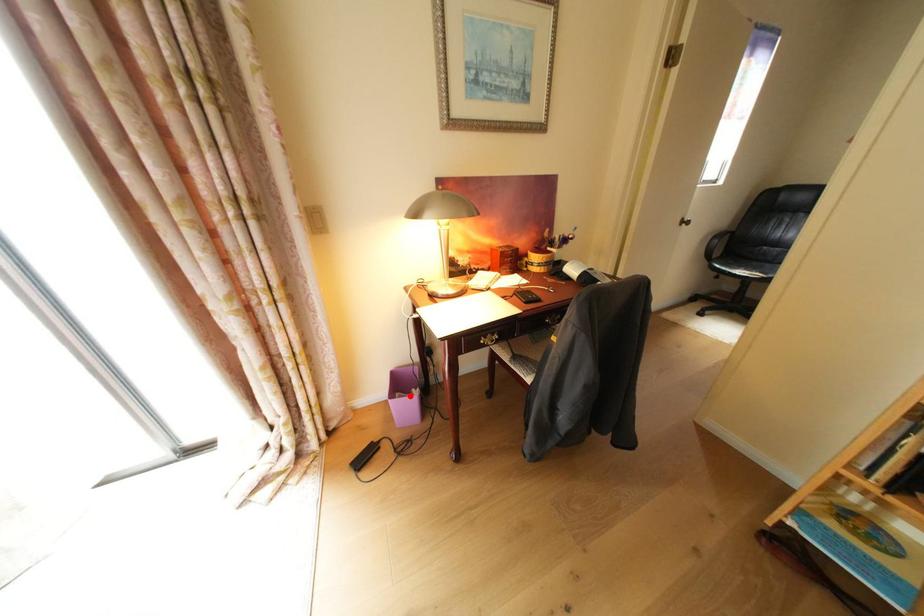
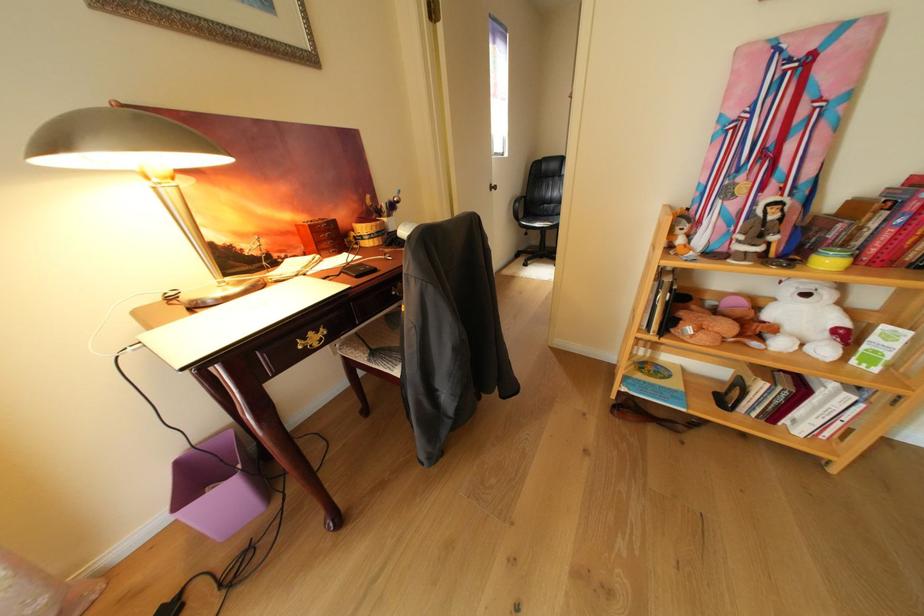
Question: I am providing you with two images of the same scene from different viewpoints. Image1 has a red point marked. In image2, the corresponding 3D location appears at what relative position? Reply with the corresponding letter.

Choices:
 (A) Closer
 (B) Farther

Answer: (A)